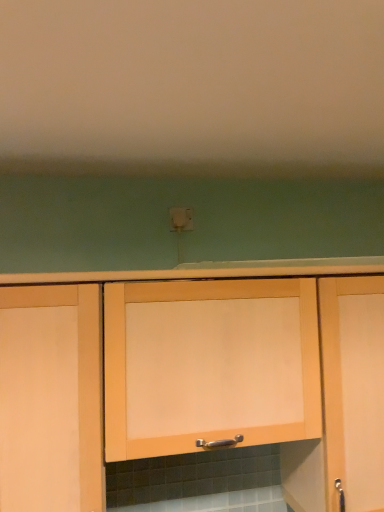
Question: Considering the positions of matte wood cabinet at left, the 3th cabinetry in the right-to-left sequence, and light wood cabinet at center, acting as the third cabinetry starting from the left, in the image, is matte wood cabinet at left, the 3th cabinetry in the right-to-left sequence, taller or shorter than light wood cabinet at center, acting as the third cabinetry starting from the left,?

Choices:
 (A) tall
 (B) short

Answer: (B)

Question: Is matte wood cabinet at left, the first cabinetry when ordered from left to right, to the left or to the right of light wood cabinet at center, acting as the third cabinetry starting from the left, in the image?

Choices:
 (A) right
 (B) left

Answer: (B)

Question: Based on their relative distances, which object is nearer to the white plastic electric outlet at center?

Choices:
 (A) light wood cabinet at center, acting as the third cabinetry starting from the left
 (B) matte wood cabinet at left, the first cabinetry when ordered from left to right
 (C) light wood cabinet at center, acting as the 2th cabinetry starting from the right

Answer: (C)

Question: Which object is positioned farthest from the matte wood cabinet at left, the first cabinetry when ordered from left to right?

Choices:
 (A) light wood cabinet at center, acting as the 2th cabinetry starting from the right
 (B) light wood cabinet at center, acting as the third cabinetry starting from the left
 (C) white plastic electric outlet at center

Answer: (B)